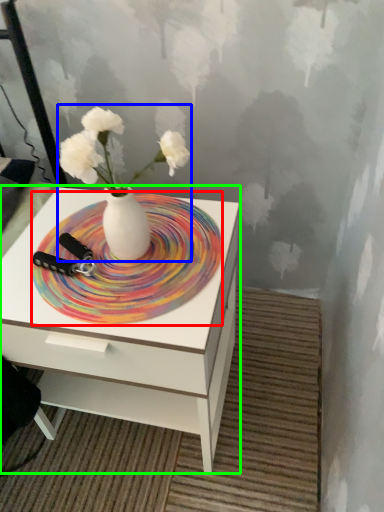
Question: Which is farther away from plate (highlighted by a red box)? floral arrangement (highlighted by a blue box) or nightstand (highlighted by a green box)?

Choices:
 (A) floral arrangement
 (B) nightstand

Answer: (B)